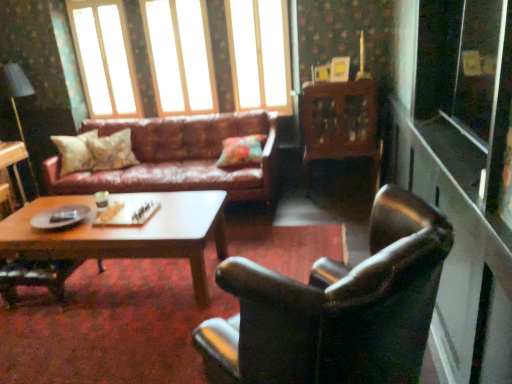
The width and height of the screenshot is (512, 384). I want to click on vacant area that lies between leather couch at center and wooden cabinet at center, so click(x=309, y=207).